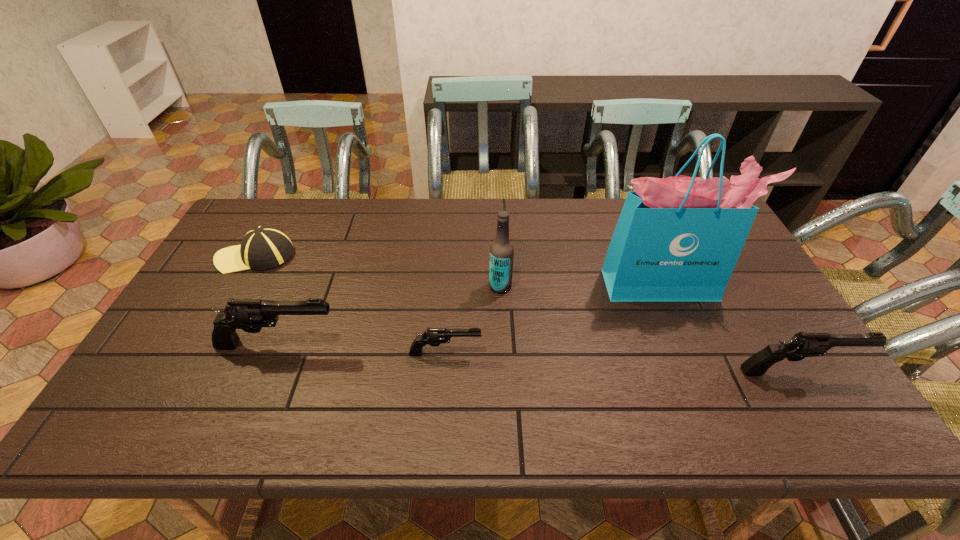
Locate an element on the screen. This screenshot has width=960, height=540. free space between the fourth object from left to right and the leftmost gun is located at coordinates (390, 315).

At what (x,y) coordinates should I click in order to perform the action: click on vacant space in between the fourth object from right to left and the beer bottle. Please return your answer as a coordinate pair (x, y). This screenshot has width=960, height=540. Looking at the image, I should click on (473, 320).

At what (x,y) coordinates should I click in order to perform the action: click on free space between the tallest object and the nearest gun. Please return your answer as a coordinate pair (x, y). Looking at the image, I should click on (730, 328).

The image size is (960, 540). I want to click on vacant space that's between the shortest gun and the rightmost gun, so click(621, 362).

This screenshot has width=960, height=540. Find the location of `free space between the third object from left to right and the tallest object`. free space between the third object from left to right and the tallest object is located at coordinates pos(554,319).

This screenshot has width=960, height=540. What are the coordinates of `vacant area that lies between the fifth shortest object and the leftmost gun` in the screenshot? It's located at (390, 315).

Identify which object is located as the fifth nearest to the nearest object. Please provide its 2D coordinates. Your answer should be formatted as a tuple, i.e. [(x, y)], where the tuple contains the x and y coordinates of a point satisfying the conditions above.

[(264, 247)]

Image resolution: width=960 pixels, height=540 pixels. I want to click on the second closest object to the tallest object, so tap(501, 250).

Where is `gun that is the second nearest to the beer bottle`? gun that is the second nearest to the beer bottle is located at coordinates [x=250, y=315].

I want to click on gun that is the closest to the shortest gun, so click(x=250, y=315).